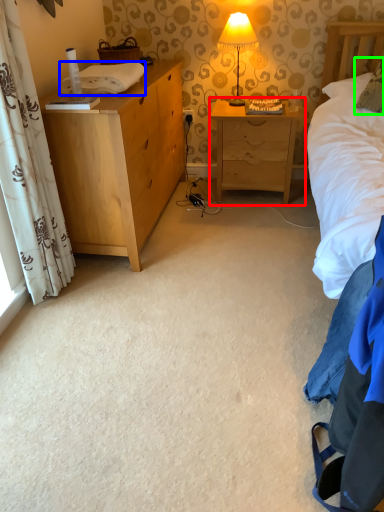
Question: Which object is positioned closest to nightstand (highlighted by a red box)? Select from cloth (highlighted by a blue box) and pillow (highlighted by a green box).

Choices:
 (A) cloth
 (B) pillow

Answer: (B)